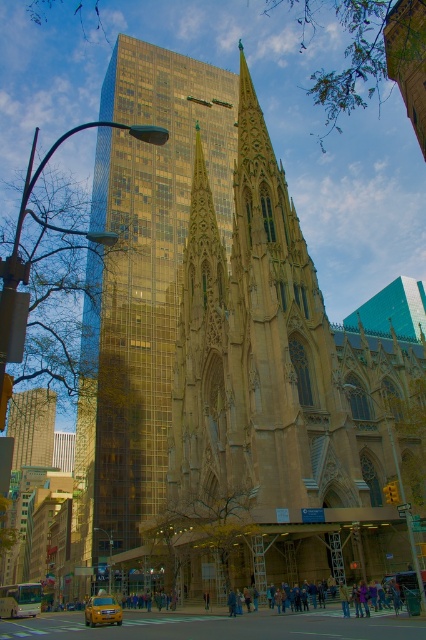
Does golden stone church at center have a lesser width compared to gold glass skyscraper at center?

No.

Who is lower down, golden stone church at center or gold glass skyscraper at center?

gold glass skyscraper at center

Is point (104, 493) positioned after point (11, 413)?

No, (104, 493) is in front of (11, 413).

Where is `golden stone church at center`? The image size is (426, 640). golden stone church at center is located at coordinates (226, 353).

Can you confirm if golden stone church at center is positioned to the left of yellow matte taxi at lower center?

In fact, golden stone church at center is to the right of yellow matte taxi at lower center.

Between point (250, 492) and point (86, 611), which one is positioned behind?

The point (86, 611) is behind.

Looking at this image, who is more forward, (144, 520) or (91, 621)?

Point (91, 621) is more forward.

Find the location of a particular element. golden stone church at center is located at coordinates (226, 353).

Is point (9, 416) closer to camera compared to point (94, 614)?

No, (9, 416) is further to viewer.

Which is below, gold glass skyscraper at center or yellow matte taxi at lower center?

Positioned lower is yellow matte taxi at lower center.

What do you see at coordinates (31, 426) in the screenshot? The height and width of the screenshot is (640, 426). I see `gold glass skyscraper at center` at bounding box center [31, 426].

Image resolution: width=426 pixels, height=640 pixels. In order to click on gold glass skyscraper at center in this screenshot , I will do `click(31, 426)`.